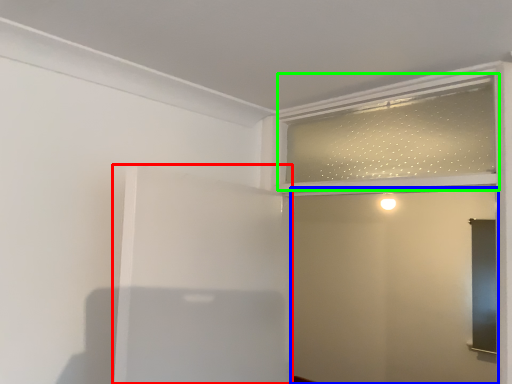
Question: Based on their relative distances, which object is nearer to elevator (highlighted by a red box)? Choose from screen door (highlighted by a blue box) and window frame (highlighted by a green box).

Choices:
 (A) screen door
 (B) window frame

Answer: (B)